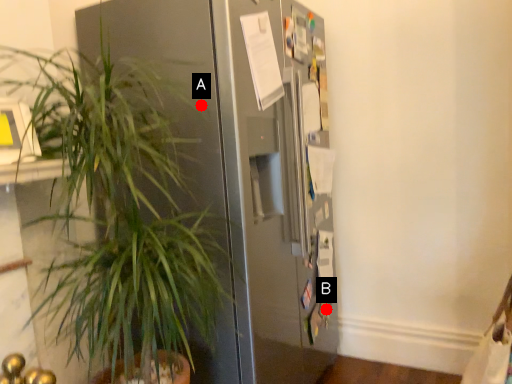
Question: Two points are circled on the image, labeled by A and B beside each circle. Which point appears closest to the camera in this image?

Choices:
 (A) A is closer
 (B) B is closer

Answer: (A)